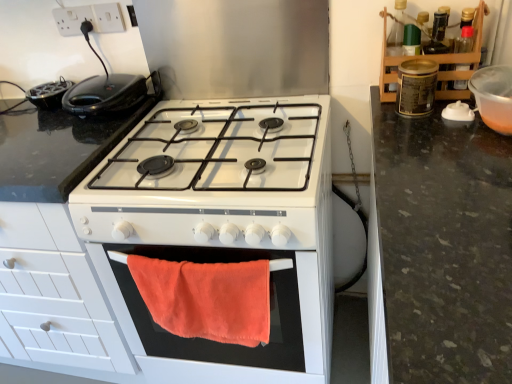
Question: From the image's perspective, is metallic canister at upper right, acting as the 3th appliance starting from the left, located above orange fabric towel at center?

Choices:
 (A) yes
 (B) no

Answer: (A)

Question: Can you see metallic canister at upper right, which is the 2th appliance from right to left, touching orange fabric towel at center?

Choices:
 (A) yes
 (B) no

Answer: (B)

Question: Is metallic canister at upper right, which is the 2th appliance from right to left, far from orange fabric towel at center?

Choices:
 (A) no
 (B) yes

Answer: (A)

Question: Would you say orange fabric towel at center is part of metallic canister at upper right, acting as the 3th appliance starting from the left,'s contents?

Choices:
 (A) yes
 (B) no

Answer: (B)

Question: Is the position of metallic canister at upper right, which is the 2th appliance from right to left, more distant than that of orange fabric towel at center?

Choices:
 (A) no
 (B) yes

Answer: (B)

Question: Can you confirm if metallic canister at upper right, acting as the 3th appliance starting from the left, is positioned to the left of orange fabric towel at center?

Choices:
 (A) yes
 (B) no

Answer: (B)

Question: Does black plastic sandwich maker at upper left have a lesser height compared to white plastic socket at upper left, arranged as the 2th electric outlet when viewed from the right?

Choices:
 (A) yes
 (B) no

Answer: (A)

Question: Can you confirm if black plastic sandwich maker at upper left is positioned to the left of white plastic socket at upper left, arranged as the 2th electric outlet when viewed from the right?

Choices:
 (A) yes
 (B) no

Answer: (B)

Question: Is the depth of black plastic sandwich maker at upper left greater than that of white plastic socket at upper left, arranged as the 2th electric outlet when viewed from the right?

Choices:
 (A) no
 (B) yes

Answer: (A)

Question: Can you confirm if black plastic sandwich maker at upper left is positioned to the right of white plastic socket at upper left, which is the first electric outlet from left to right?

Choices:
 (A) no
 (B) yes

Answer: (B)

Question: From the image's perspective, is black plastic sandwich maker at upper left located beneath white plastic socket at upper left, arranged as the 2th electric outlet when viewed from the right?

Choices:
 (A) no
 (B) yes

Answer: (B)

Question: Does black plastic sandwich maker at upper left have a greater width compared to white plastic socket at upper left, which is the first electric outlet from left to right?

Choices:
 (A) no
 (B) yes

Answer: (B)

Question: Does white plastic socket at upper left, placed as the second electric outlet when sorted from left to right, have a smaller size compared to metallic canister at upper right, which is the 2th appliance from right to left?

Choices:
 (A) no
 (B) yes

Answer: (B)